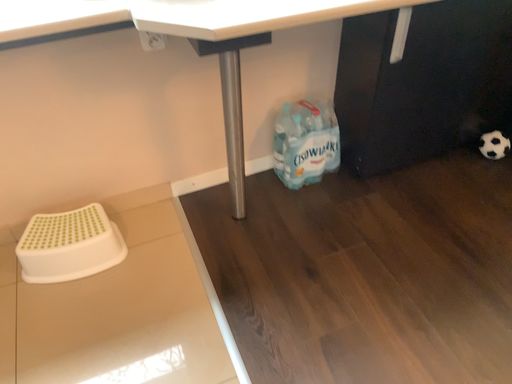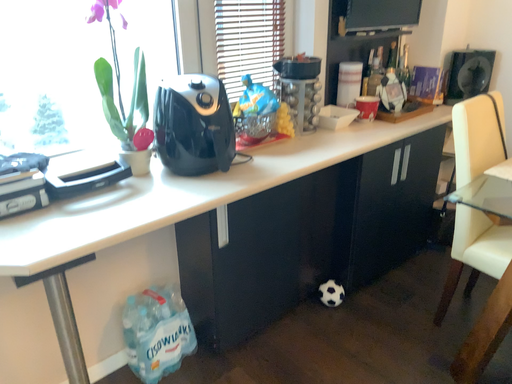
Question: How did the camera likely rotate when shooting the video?

Choices:
 (A) rotated right
 (B) rotated left

Answer: (A)